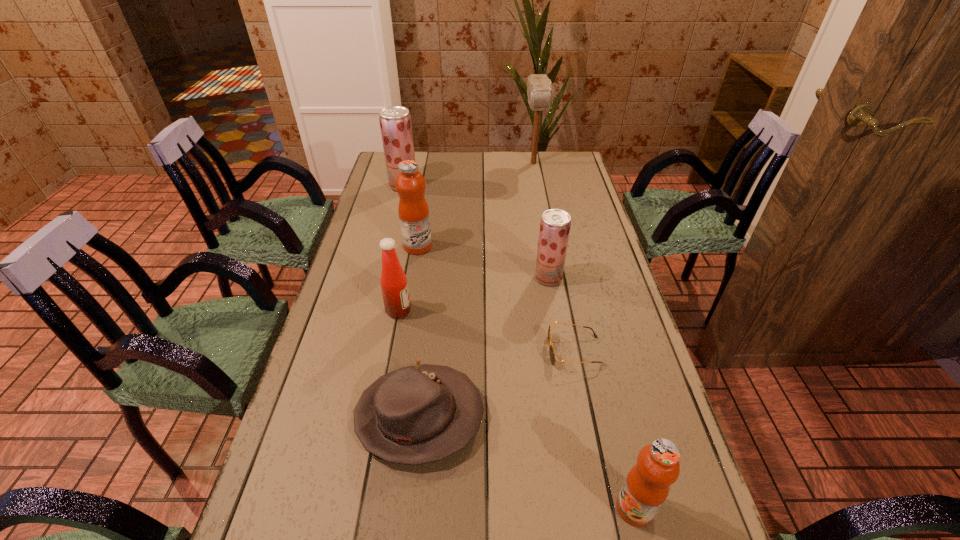
This screenshot has width=960, height=540. Identify the location of vacant position in the image that satisfies the following two spatial constraints: 1. on the striking face of the mallet; 2. on the front label of the bigger orange fruit juice. (549, 246).